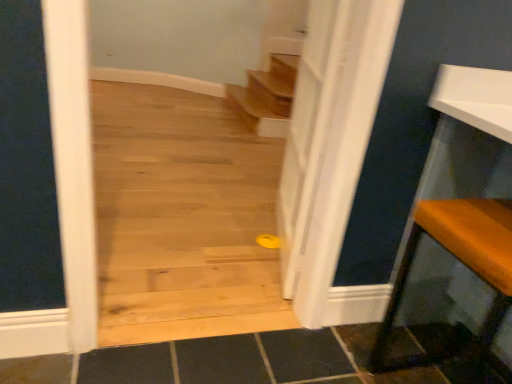
Question: Do you think white glossy door at center is within orange fabric cushion at right, or outside of it?

Choices:
 (A) inside
 (B) outside

Answer: (B)

Question: Relative to orange fabric cushion at right, is white glossy door at center in front or behind?

Choices:
 (A) front
 (B) behind

Answer: (B)

Question: Considering the positions of white glossy door at center and orange fabric cushion at right in the image, is white glossy door at center taller or shorter than orange fabric cushion at right?

Choices:
 (A) tall
 (B) short

Answer: (A)

Question: Which is correct: orange fabric cushion at right is inside white glossy door at center, or outside of it?

Choices:
 (A) inside
 (B) outside

Answer: (B)

Question: From the image's perspective, is orange fabric cushion at right above or below white glossy door at center?

Choices:
 (A) above
 (B) below

Answer: (B)

Question: In terms of height, does orange fabric cushion at right look taller or shorter compared to white glossy door at center?

Choices:
 (A) short
 (B) tall

Answer: (A)

Question: Looking at the image, does orange fabric cushion at right seem bigger or smaller compared to white glossy door at center?

Choices:
 (A) small
 (B) big

Answer: (B)